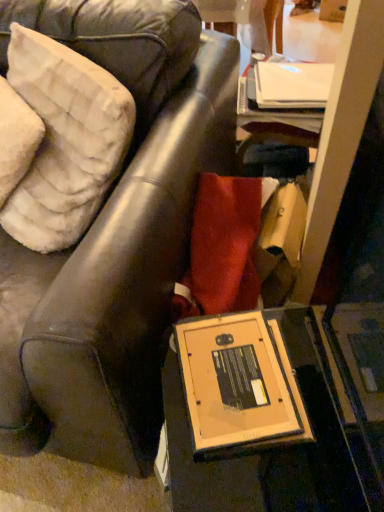
Question: Considering the relative positions of matte brown leather chair at center and white plush pillow at upper left, which is the 1th pillow from right to left, in the image provided, is matte brown leather chair at center to the right of white plush pillow at upper left, which is the 1th pillow from right to left, from the viewer's perspective?

Choices:
 (A) yes
 (B) no

Answer: (B)

Question: Is matte brown leather chair at center wider than white plush pillow at upper left, which is the 1th pillow from right to left?

Choices:
 (A) yes
 (B) no

Answer: (A)

Question: Is matte brown leather chair at center turned away from white plush pillow at upper left, which is the 1th pillow from right to left?

Choices:
 (A) no
 (B) yes

Answer: (B)

Question: Is matte brown leather chair at center at the left side of white plush pillow at upper left, the second pillow in the left-to-right sequence?

Choices:
 (A) yes
 (B) no

Answer: (A)

Question: Considering the relative positions of matte brown leather chair at center and white plush pillow at upper left, the second pillow in the left-to-right sequence, in the image provided, is matte brown leather chair at center in front of white plush pillow at upper left, the second pillow in the left-to-right sequence,?

Choices:
 (A) no
 (B) yes

Answer: (B)

Question: Is matte brown leather chair at center bigger than white plush pillow at upper left, the second pillow in the left-to-right sequence?

Choices:
 (A) no
 (B) yes

Answer: (B)

Question: Could you tell me if white fluffy pillow at upper left, the second pillow when ordered from right to left, is turned towards matte brown leather chair at center?

Choices:
 (A) yes
 (B) no

Answer: (A)

Question: From the image's perspective, would you say white fluffy pillow at upper left, the second pillow when ordered from right to left, is shown under matte brown leather chair at center?

Choices:
 (A) no
 (B) yes

Answer: (A)

Question: Is white fluffy pillow at upper left, the second pillow when ordered from right to left, located outside matte brown leather chair at center?

Choices:
 (A) yes
 (B) no

Answer: (B)

Question: Would you say matte brown leather chair at center is part of white fluffy pillow at upper left, the first pillow viewed from the left,'s contents?

Choices:
 (A) yes
 (B) no

Answer: (B)

Question: Is white fluffy pillow at upper left, the first pillow viewed from the left, positioned in front of matte brown leather chair at center?

Choices:
 (A) yes
 (B) no

Answer: (B)

Question: Is white fluffy pillow at upper left, the first pillow viewed from the left, not close to matte brown leather chair at center?

Choices:
 (A) no
 (B) yes

Answer: (A)

Question: Does white plush pillow at upper left, which is the 1th pillow from right to left, have a lesser height compared to white fluffy pillow at upper left, the second pillow when ordered from right to left?

Choices:
 (A) no
 (B) yes

Answer: (A)